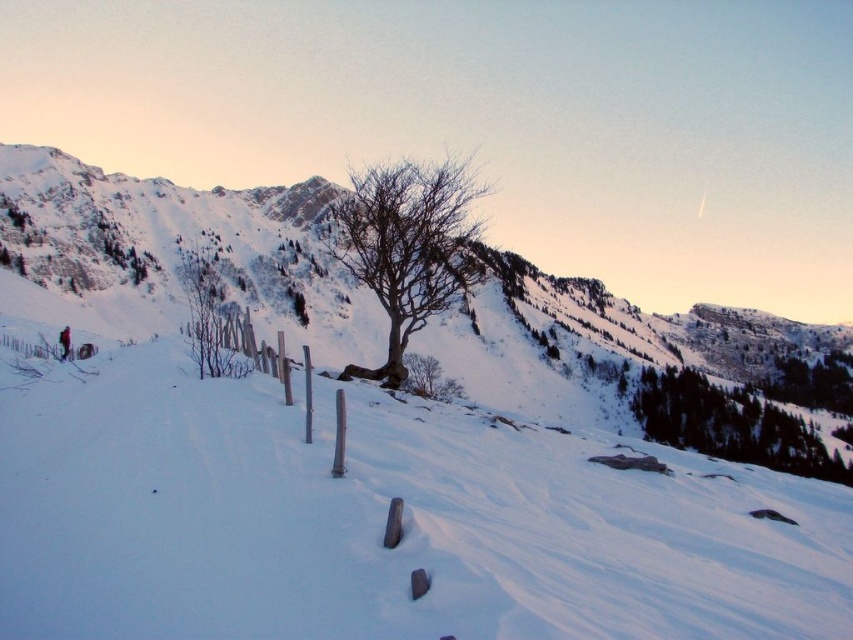
You are standing at the point marked by the coordinates point at (379, 522) in the image. Based on the scene description, what is the immediate surface you are standing on?

The point at (379, 522) is on white snow at center, so the immediate surface you are standing on is white snow.

You are planning to place a 100 foot long fence between the white snow at center and the bare wood tree at center. Is there enough space to fit the fence between them?

The distance between the white snow at center and the bare wood tree at center is 252.67 feet, which is more than enough to accommodate a 100 foot long fence between them.